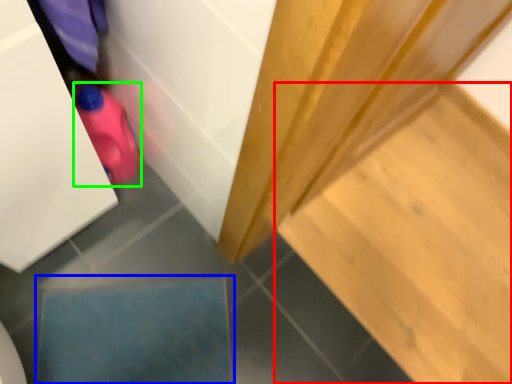
Question: Which object is the farthest from stair (highlighted by a red box)? Choose among these: square (highlighted by a blue box) or stuff (highlighted by a green box).

Choices:
 (A) square
 (B) stuff

Answer: (B)